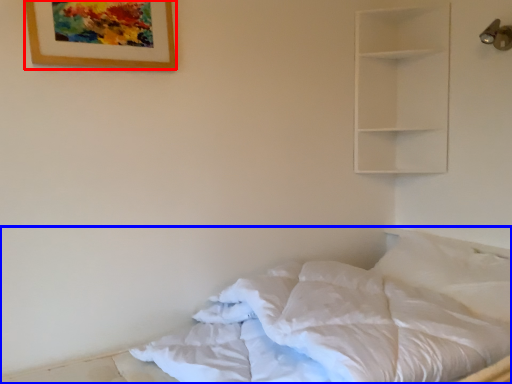
Question: Which of the following is the closest to the observer, picture frame (highlighted by a red box) or bed (highlighted by a blue box)?

Choices:
 (A) picture frame
 (B) bed

Answer: (B)